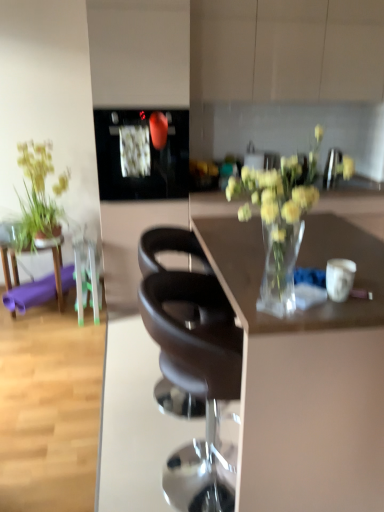
Image resolution: width=384 pixels, height=512 pixels. Identify the location of green leafy plant at left. (37, 197).

Image resolution: width=384 pixels, height=512 pixels. Describe the element at coordinates (195, 376) in the screenshot. I see `matte black chair at center, marked as the 1th chair in a front-to-back arrangement` at that location.

Locate an element on the screen. transparent glass vase at center is located at coordinates (306, 373).

Relative to matte black chair at center, positioned as the 2th chair in back-to-front order, is translucent glass vase at center in front or behind?

Clearly, translucent glass vase at center is in front of matte black chair at center, positioned as the 2th chair in back-to-front order.

Consider the image. Would you say translucent glass vase at center is inside or outside matte black chair at center, positioned as the 2th chair in back-to-front order?

translucent glass vase at center is not inside matte black chair at center, positioned as the 2th chair in back-to-front order, it's outside.

Does point (240, 178) come closer to viewer compared to point (206, 456)?

Yes, point (240, 178) is in front of point (206, 456).

From a real-world perspective, is matte black chair at center, marked as the 1th chair in a front-to-back arrangement, on transparent glass vase at center?

Incorrect, from a real-world perspective, matte black chair at center, marked as the 1th chair in a front-to-back arrangement, is lower than transparent glass vase at center.

Is matte black chair at center, marked as the 1th chair in a front-to-back arrangement, taller than transparent glass vase at center?

Incorrect, the height of matte black chair at center, marked as the 1th chair in a front-to-back arrangement, is not larger of that of transparent glass vase at center.

In the scene shown: Considering the relative sizes of matte black chair at center, positioned as the 2th chair in back-to-front order, and transparent glass vase at center in the image provided, is matte black chair at center, positioned as the 2th chair in back-to-front order, bigger than transparent glass vase at center?

No, matte black chair at center, positioned as the 2th chair in back-to-front order, is not bigger than transparent glass vase at center.

Is there a large distance between matte black chair at center, positioned as the 2th chair in back-to-front order, and transparent glass vase at center?

No, matte black chair at center, positioned as the 2th chair in back-to-front order, is not far away from transparent glass vase at center.

The height and width of the screenshot is (512, 384). What are the coordinates of `the 2nd chair to the right of the green leafy plant at left, counting from the anchor's position` in the screenshot? It's located at (195, 376).

Would you say green leafy plant at left is a long distance from matte black chair at center, positioned as the 2th chair in back-to-front order?

Absolutely, green leafy plant at left is distant from matte black chair at center, positioned as the 2th chair in back-to-front order.

From a real-world perspective, between green leafy plant at left and matte black chair at center, positioned as the 2th chair in back-to-front order, who is vertically higher?

green leafy plant at left.

From the image's perspective, is green leafy plant at left on matte black chair at center, positioned as the 2th chair in back-to-front order?

Yes, from the image's perspective, green leafy plant at left is above matte black chair at center, positioned as the 2th chair in back-to-front order.

From the image's perspective, relative to black glossy microwave at upper center, is matte black chair at center, positioned as the 2th chair in back-to-front order, above or below?

matte black chair at center, positioned as the 2th chair in back-to-front order, is situated lower than black glossy microwave at upper center in the image.

In the image, is matte black chair at center, marked as the 1th chair in a front-to-back arrangement, positioned in front of or behind black glossy microwave at upper center?

In the image, matte black chair at center, marked as the 1th chair in a front-to-back arrangement, appears in front of black glossy microwave at upper center.

Which object is wider, matte black chair at center, marked as the 1th chair in a front-to-back arrangement, or black glossy microwave at upper center?

→ black glossy microwave at upper center is wider.

Who is smaller, matte black chair at center, marked as the 1th chair in a front-to-back arrangement, or black glossy microwave at upper center?

black glossy microwave at upper center is smaller.

Is point (57, 247) positioned before point (46, 218)?

No, it is behind (46, 218).

At what (x,y) coordinates should I click in order to perform the action: click on houseplant that is behind the purple rubber mat at left. Please return your answer as a coordinate pair (x, y). Looking at the image, I should click on (37, 197).

Looking at this image, is purple rubber mat at left next to green leafy plant at left?

No, purple rubber mat at left is not next to green leafy plant at left.

In terms of size, does matte black chair at center, marked as the 1th chair in a front-to-back arrangement, appear bigger or smaller than green leafy plant at left?

In the image, matte black chair at center, marked as the 1th chair in a front-to-back arrangement, appears to be larger than green leafy plant at left.

Does matte black chair at center, marked as the 1th chair in a front-to-back arrangement, have a greater height compared to green leafy plant at left?

Indeed, matte black chair at center, marked as the 1th chair in a front-to-back arrangement, has a greater height compared to green leafy plant at left.

Considering the relative positions of matte black chair at center, marked as the 1th chair in a front-to-back arrangement, and green leafy plant at left in the image provided, is matte black chair at center, marked as the 1th chair in a front-to-back arrangement, to the left of green leafy plant at left from the viewer's perspective?

No.

Considering their positions, is black glossy microwave at upper center located in front of or behind matte black chair at center, positioned as the 2th chair in back-to-front order?

Visually, black glossy microwave at upper center is located behind matte black chair at center, positioned as the 2th chair in back-to-front order.

Does black glossy microwave at upper center appear on the left side of matte black chair at center, marked as the 1th chair in a front-to-back arrangement?

Indeed, black glossy microwave at upper center is positioned on the left side of matte black chair at center, marked as the 1th chair in a front-to-back arrangement.

From the image's perspective, would you say black glossy microwave at upper center is positioned over matte black chair at center, positioned as the 2th chair in back-to-front order?

Correct, black glossy microwave at upper center appears higher than matte black chair at center, positioned as the 2th chair in back-to-front order, in the image.

What's the angular difference between black glossy microwave at upper center and matte black chair at center, positioned as the 2th chair in back-to-front order,'s facing directions?

There is a 90-degree angle between the facing directions of black glossy microwave at upper center and matte black chair at center, positioned as the 2th chair in back-to-front order.

Where is `the 1st chair directly beneath the translucent glass vase at center (from a real-world perspective)`? The height and width of the screenshot is (512, 384). the 1st chair directly beneath the translucent glass vase at center (from a real-world perspective) is located at coordinates (195, 376).

Where is `desk above the matte black chair at center, marked as the 1th chair in a front-to-back arrangement (from the image's perspective)`? Image resolution: width=384 pixels, height=512 pixels. desk above the matte black chair at center, marked as the 1th chair in a front-to-back arrangement (from the image's perspective) is located at coordinates (306, 373).

Which object lies nearer to the anchor point black leather chair at center, the second chair when ordered from front to back, black glossy microwave at upper center or purple rubber mat at left?

black glossy microwave at upper center lies closer to black leather chair at center, the second chair when ordered from front to back, than the other object.

Based on their spatial positions, is translucent glass vase at center or green leafy plant at left further from matte black chair at center, positioned as the 2th chair in back-to-front order?

Based on the image, green leafy plant at left appears to be further to matte black chair at center, positioned as the 2th chair in back-to-front order.

Based on their spatial positions, is black leather chair at center, the 1th chair when ordered from back to front, or black glossy microwave at upper center closer to translucent glass vase at center?

The object closer to translucent glass vase at center is black leather chair at center, the 1th chair when ordered from back to front.

Which object lies further to the anchor point translucent glass vase at center, green leafy plant at left or purple rubber mat at left?

The object further to translucent glass vase at center is purple rubber mat at left.

Looking at the image, which one is located further to transparent glass vase at center, black glossy microwave at upper center or translucent glass vase at center?

Based on the image, black glossy microwave at upper center appears to be further to transparent glass vase at center.

From the image, which object appears to be farther from translucent glass vase at center, purple rubber mat at left or transparent glass vase at center?

Among the two, purple rubber mat at left is located further to translucent glass vase at center.

Which object lies further to the anchor point transparent glass vase at center, green leafy plant at left or black glossy microwave at upper center?

Among the two, green leafy plant at left is located further to transparent glass vase at center.

Looking at the image, which one is located further to black leather chair at center, the second chair when ordered from front to back, translucent glass vase at center or purple rubber mat at left?

Based on the image, purple rubber mat at left appears to be further to black leather chair at center, the second chair when ordered from front to back.

In order to click on appliance located between matte black chair at center, positioned as the 2th chair in back-to-front order, and purple rubber mat at left in the depth direction in this screenshot , I will do `click(141, 155)`.

Locate an element on the screen. This screenshot has height=512, width=384. table between translucent glass vase at center and green leafy plant at left from front to back is located at coordinates (36, 281).

I want to click on houseplant between purple rubber mat at left and black glossy microwave at upper center, so click(x=37, y=197).

Where is `desk located between translucent glass vase at center and black glossy microwave at upper center in the depth direction`? Image resolution: width=384 pixels, height=512 pixels. desk located between translucent glass vase at center and black glossy microwave at upper center in the depth direction is located at coordinates (306, 373).